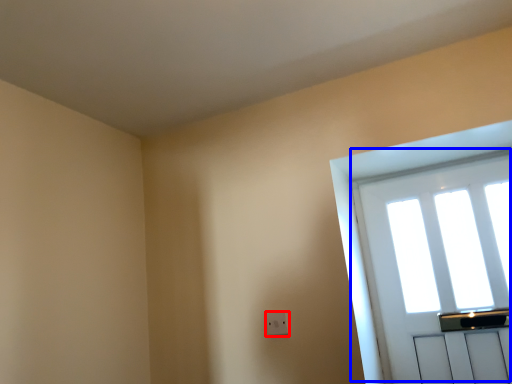
Question: Which point is closer to the camera, electric outlet (highlighted by a red box) or window (highlighted by a blue box)?

Choices:
 (A) electric outlet
 (B) window

Answer: (B)